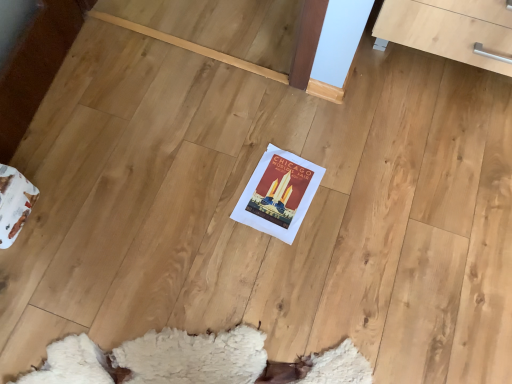
Locate an element on the screen. blank space situated above white paper magazine at center (from a real-world perspective) is located at coordinates tap(282, 190).